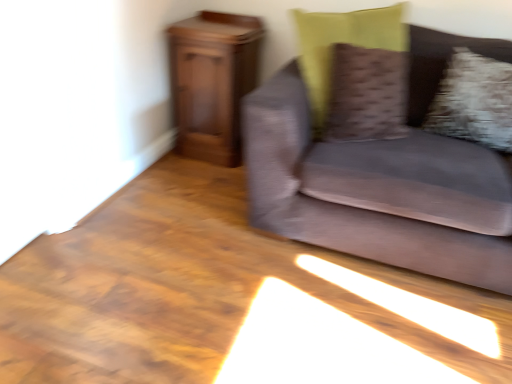
Where is `free space that is in between wooden cabinet at left and velvet gray couch at right`? This screenshot has height=384, width=512. free space that is in between wooden cabinet at left and velvet gray couch at right is located at coordinates (x=211, y=190).